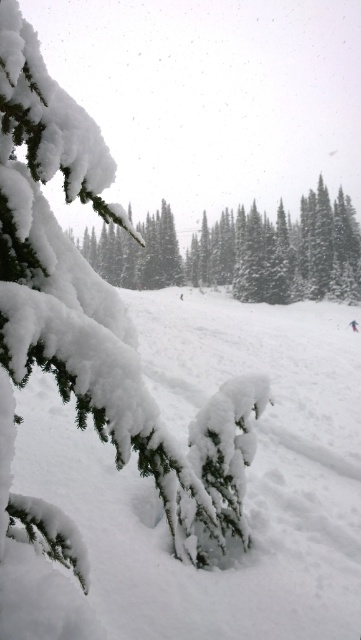
Question: Is snow-covered pine branch at center positioned behind white matte snowboarder at center?

Choices:
 (A) no
 (B) yes

Answer: (B)

Question: Is white snow ski slope at center behind snow-covered pine branch at left?

Choices:
 (A) yes
 (B) no

Answer: (A)

Question: Which point is farther from the camera taking this photo?

Choices:
 (A) (93, 234)
 (B) (267, 352)
 (C) (353, 330)
 (D) (237, 502)

Answer: (A)

Question: Considering the real-world distances, which object is farthest from the snow-covered pine branch at center?

Choices:
 (A) white snow ski slope at center
 (B) white matte snowboarder at center

Answer: (A)

Question: Is snow-covered pine branch at center to the left of white matte snowboarder at center from the viewer's perspective?

Choices:
 (A) yes
 (B) no

Answer: (A)

Question: Estimate the real-world distances between objects in this image. Which object is closer to the snow-covered pine branch at center?

Choices:
 (A) white snow ski slope at center
 (B) white matte snowboarder at center
 (C) snow-covered pine branch at left

Answer: (B)